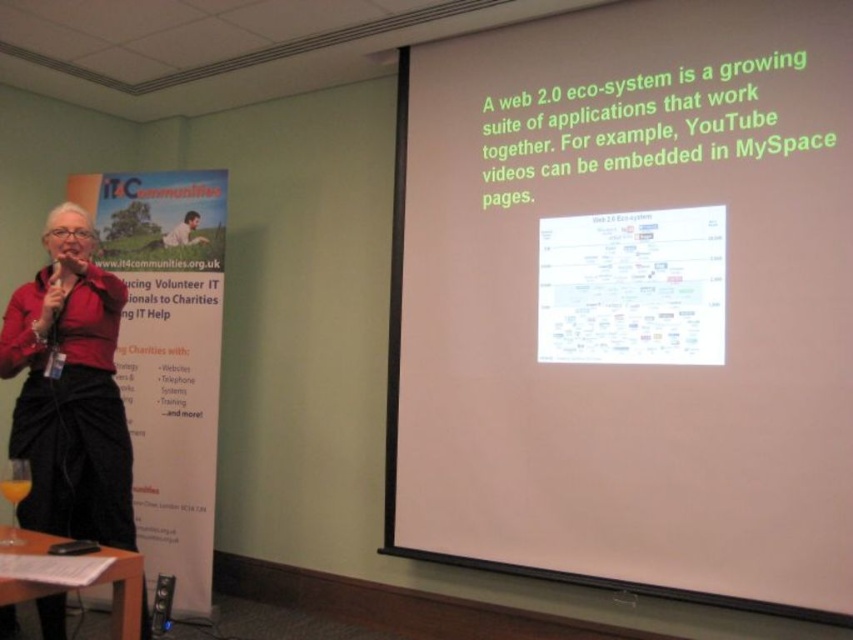
How far apart are white matte projection screen at center and velvet-like black skirt at left?

white matte projection screen at center and velvet-like black skirt at left are 1.78 meters apart from each other.

Who is positioned more to the left, white matte projection screen at center or velvet-like black skirt at left?

From the viewer's perspective, velvet-like black skirt at left appears more on the left side.

Find the location of `white matte projection screen at center`. white matte projection screen at center is located at coordinates (630, 301).

What are the coordinates of `white matte projection screen at center` in the screenshot? It's located at (630, 301).